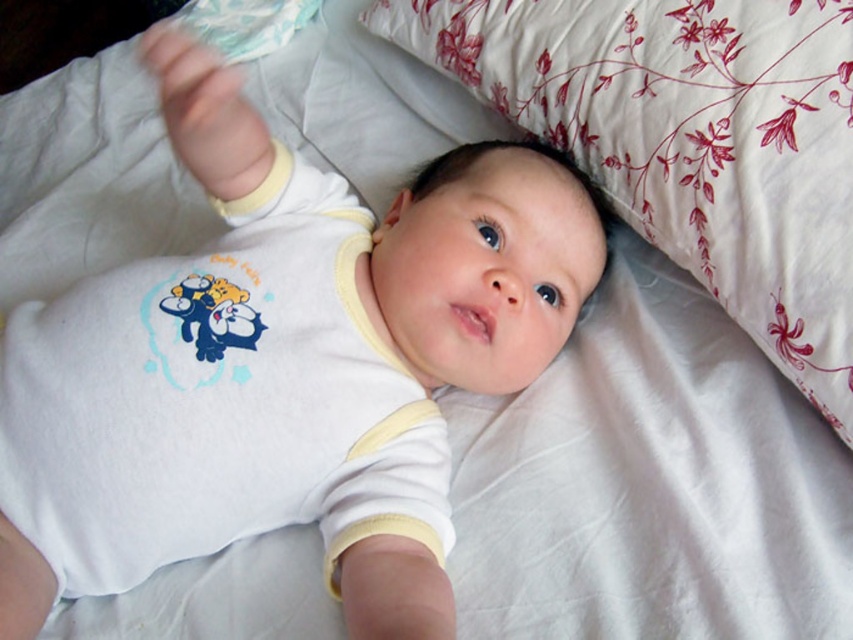
Who is positioned more to the left, white floral pillow at upper center or white cotton onesie at center?

From the viewer's perspective, white cotton onesie at center appears more on the left side.

Does point (805, 272) lie in front of point (9, 346)?

Yes, point (805, 272) is closer to viewer.

At what (x,y) coordinates should I click in order to perform the action: click on white floral pillow at upper center. Please return your answer as a coordinate pair (x, y). This screenshot has height=640, width=853. Looking at the image, I should click on (689, 141).